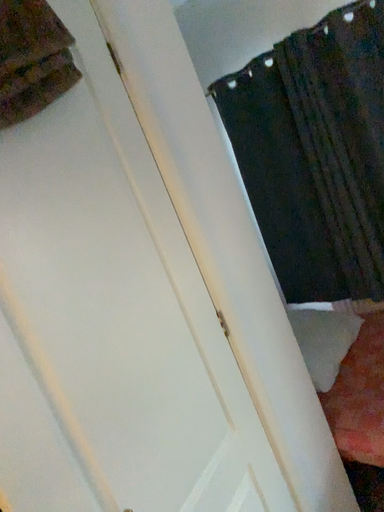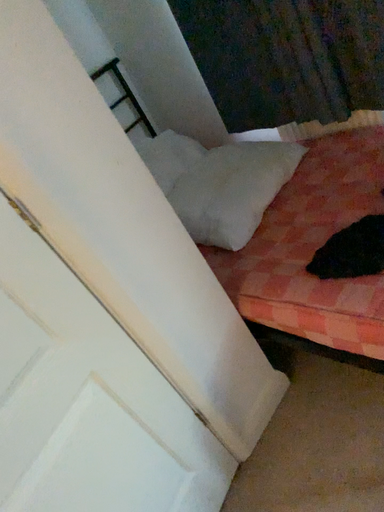
Question: Which way did the camera rotate in the video?

Choices:
 (A) rotated downward
 (B) rotated upward

Answer: (A)